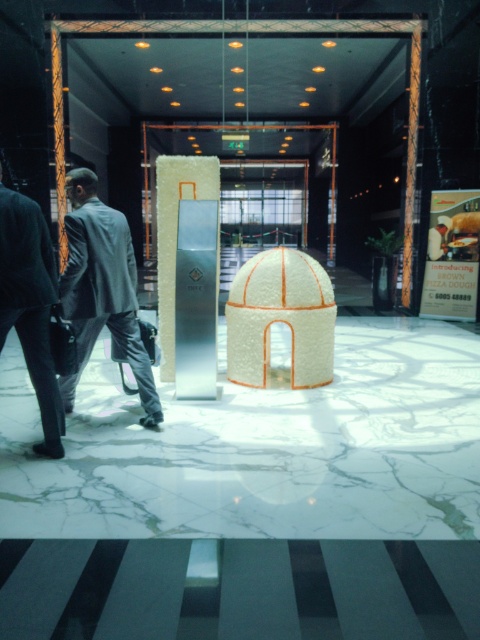
Question: Is silver metallic pillar at center bigger than gray suit at left?

Choices:
 (A) yes
 (B) no

Answer: (A)

Question: Does gray suit at left appear over dark gray suit at left?

Choices:
 (A) no
 (B) yes

Answer: (B)

Question: Which point is farther to the camera?

Choices:
 (A) (196, 188)
 (B) (33, 362)

Answer: (A)

Question: Estimate the real-world distances between objects in this image. Which object is closer to the dark gray suit at left?

Choices:
 (A) gray suit at left
 (B) silver metallic pillar at center

Answer: (A)

Question: Is silver metallic pillar at center to the left of dark gray suit at left from the viewer's perspective?

Choices:
 (A) yes
 (B) no

Answer: (B)

Question: Which point is closer to the camera?

Choices:
 (A) dark gray suit at left
 (B) gray suit at left

Answer: (A)